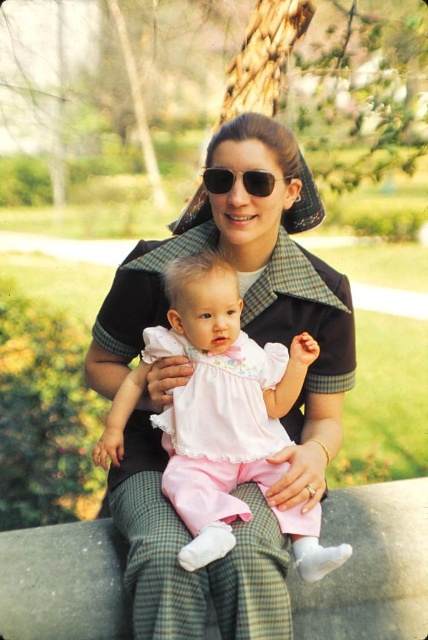
Who is lower down, pink satin dress at center or black matte sunglasses at center?

pink satin dress at center

Does pink satin dress at center appear under black matte sunglasses at center?

Correct, pink satin dress at center is located below black matte sunglasses at center.

Is point (199, 365) farther from viewer compared to point (252, 177)?

No.

This screenshot has width=428, height=640. I want to click on pink satin dress at center, so click(213, 404).